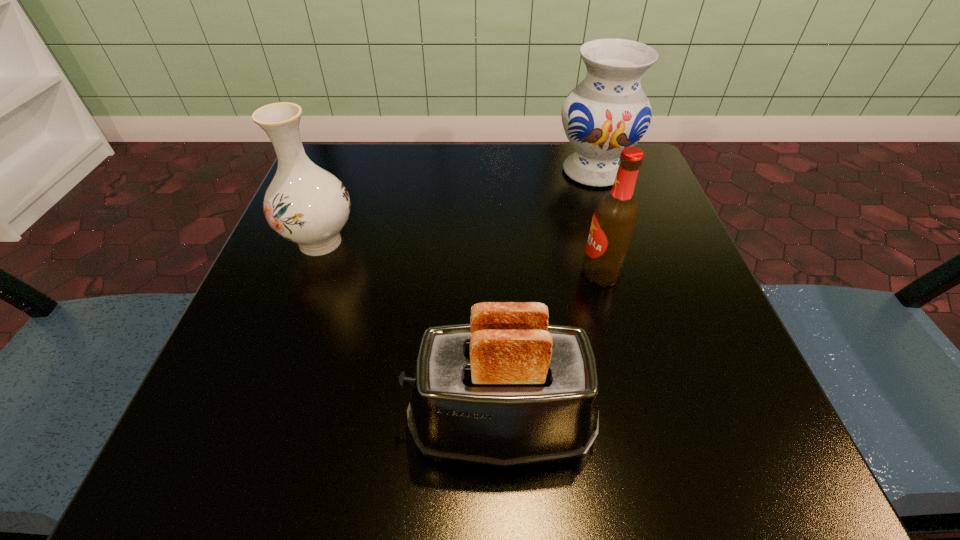
In the image, there is a desktop. Where is `vacant space at the near edge`? vacant space at the near edge is located at coordinates (328, 448).

What are the coordinates of `vacant point at the left edge` in the screenshot? It's located at (259, 306).

Locate an element on the screen. free space at the right edge is located at coordinates (628, 334).

In the image, there is a desktop. Identify the location of free space at the far left corner. This screenshot has height=540, width=960. (322, 160).

Identify the location of vacant area at the far right corner of the desktop. (580, 187).

The image size is (960, 540). What are the coordinates of `vacant area that lies between the farthest object and the left vase` in the screenshot? It's located at (457, 206).

You are a GUI agent. You are given a task and a screenshot of the screen. Output one action in this format:
    pyautogui.click(x=<x>, y=<y>)
    Task: Click on the free space between the farthest object and the leftmost object
    Image resolution: width=960 pixels, height=540 pixels.
    Given the screenshot: What is the action you would take?
    pyautogui.click(x=457, y=206)

Image resolution: width=960 pixels, height=540 pixels. I want to click on vacant space that's between the second object from left to right and the leftmost object, so click(411, 334).

What are the coordinates of `free space between the right vase and the nearer vase` in the screenshot? It's located at (457, 206).

Where is `free area in between the left vase and the right vase`? The image size is (960, 540). free area in between the left vase and the right vase is located at coordinates (457, 206).